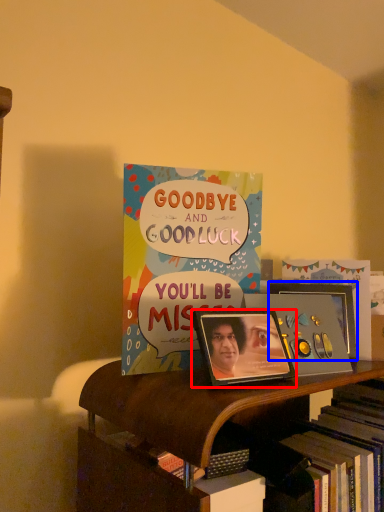
Question: Among these objects, which one is nearest to the camera, picture frame (highlighted by a red box) or picture frame (highlighted by a blue box)?

Choices:
 (A) picture frame
 (B) picture frame

Answer: (A)